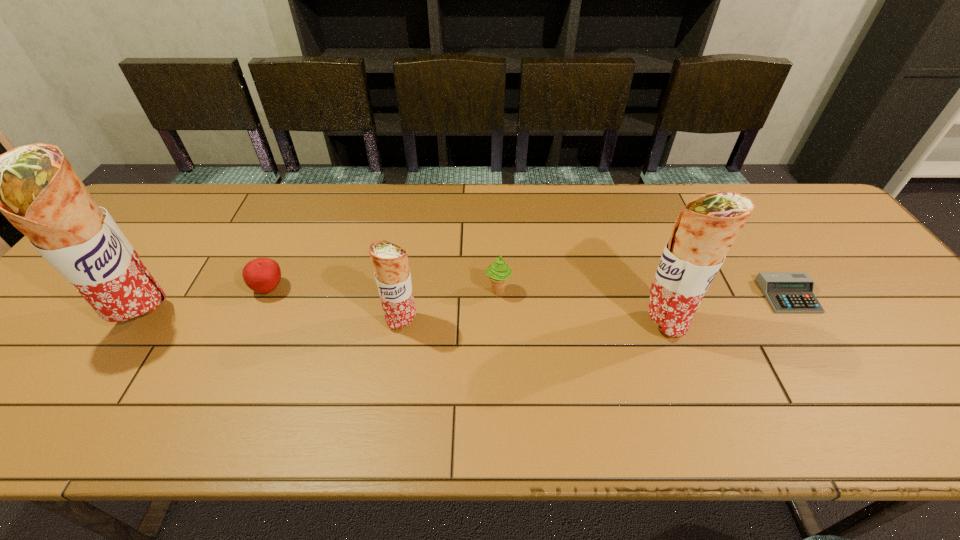
The height and width of the screenshot is (540, 960). What are the coordinates of `icecream` in the screenshot? It's located at (498, 272).

Where is `vacant region located on the front of the leftmost object`? vacant region located on the front of the leftmost object is located at coordinates (117, 359).

Where is `vacant space situated 0.180m on the left of the second burrito from left to right`? vacant space situated 0.180m on the left of the second burrito from left to right is located at coordinates (312, 321).

What are the coordinates of `free spot located on the front of the fifth object from left to right` in the screenshot? It's located at (684, 382).

Identify the location of free space located 0.290m on the right of the fifth object from right to left. The height and width of the screenshot is (540, 960). (398, 288).

At what (x,y) coordinates should I click in order to perform the action: click on vacant space located 0.250m on the left of the calculator. Please return your answer as a coordinate pair (x, y). The image size is (960, 540). Looking at the image, I should click on (666, 296).

Find the location of a particular element. free region located 0.110m on the right of the icecream is located at coordinates (554, 291).

At what (x,y) coordinates should I click in order to perform the action: click on blank space at the far edge of the desktop. Please return your answer as a coordinate pair (x, y). Looking at the image, I should click on (428, 225).

Find the location of `vacant space at the near edge of the desktop`. vacant space at the near edge of the desktop is located at coordinates (513, 370).

Locate an element on the screen. This screenshot has height=540, width=960. free region at the far right corner of the desktop is located at coordinates (783, 230).